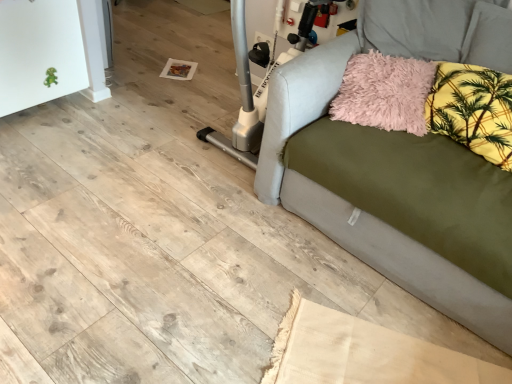
What do you see at coordinates (396, 163) in the screenshot? The image size is (512, 384). I see `olive green fabric couch at right` at bounding box center [396, 163].

What are the coordinates of `yellow floral fabric pillow at upper right, acting as the 1th pillow starting from the right` in the screenshot? It's located at point(473,110).

Locate an element on the screen. Image resolution: width=512 pixels, height=384 pixels. beige fabric rug at lower center is located at coordinates (362, 353).

Locate an element on the screen. The width and height of the screenshot is (512, 384). fluffy pink pillow at upper right, placed as the second pillow when sorted from right to left is located at coordinates (384, 92).

Locate an element on the screen. olive green fabric couch at right is located at coordinates (396, 163).

Is fluffy pink pillow at upper right, which ranks as the first pillow in left-to-right order, in front of or behind yellow floral fabric pillow at upper right, acting as the 1th pillow starting from the right, in the image?

Clearly, fluffy pink pillow at upper right, which ranks as the first pillow in left-to-right order, is behind yellow floral fabric pillow at upper right, acting as the 1th pillow starting from the right.

Looking at this image, considering the relative sizes of fluffy pink pillow at upper right, which ranks as the first pillow in left-to-right order, and yellow floral fabric pillow at upper right, acting as the 1th pillow starting from the right, in the image provided, is fluffy pink pillow at upper right, which ranks as the first pillow in left-to-right order, bigger than yellow floral fabric pillow at upper right, acting as the 1th pillow starting from the right,?

No, fluffy pink pillow at upper right, which ranks as the first pillow in left-to-right order, is not bigger than yellow floral fabric pillow at upper right, acting as the 1th pillow starting from the right.

Considering the points (423, 68) and (457, 77), which point is in front, point (423, 68) or point (457, 77)?

Point (457, 77)

Are fluffy pink pillow at upper right, which ranks as the first pillow in left-to-right order, and yellow floral fabric pillow at upper right, acting as the 1th pillow starting from the right, beside each other?

No, fluffy pink pillow at upper right, which ranks as the first pillow in left-to-right order, is not next to yellow floral fabric pillow at upper right, acting as the 1th pillow starting from the right.

Are beige fabric rug at lower center and fluffy pink pillow at upper right, placed as the second pillow when sorted from right to left, beside each other?

No, beige fabric rug at lower center is not making contact with fluffy pink pillow at upper right, placed as the second pillow when sorted from right to left.

Who is shorter, beige fabric rug at lower center or fluffy pink pillow at upper right, placed as the second pillow when sorted from right to left?

beige fabric rug at lower center is shorter.

Is beige fabric rug at lower center at the left side of fluffy pink pillow at upper right, placed as the second pillow when sorted from right to left?

Yes.

From a real-world perspective, is beige fabric rug at lower center below fluffy pink pillow at upper right, placed as the second pillow when sorted from right to left?

Yes, from a real-world perspective, beige fabric rug at lower center is below fluffy pink pillow at upper right, placed as the second pillow when sorted from right to left.

Is beige fabric rug at lower center facing away from yellow floral fabric pillow at upper right, acting as the 1th pillow starting from the right?

No, yellow floral fabric pillow at upper right, acting as the 1th pillow starting from the right, is not at the back of beige fabric rug at lower center.

What's the angular difference between beige fabric rug at lower center and yellow floral fabric pillow at upper right, acting as the 1th pillow starting from the right,'s facing directions?

There is a 81.9-degree angle between the facing directions of beige fabric rug at lower center and yellow floral fabric pillow at upper right, acting as the 1th pillow starting from the right.

Can you confirm if beige fabric rug at lower center is shorter than yellow floral fabric pillow at upper right, acting as the 1th pillow starting from the right?

Indeed, beige fabric rug at lower center has a lesser height compared to yellow floral fabric pillow at upper right, acting as the 1th pillow starting from the right.

The width and height of the screenshot is (512, 384). What are the coordinates of `pillow that is the 2nd one when counting rightward from the beige fabric rug at lower center` in the screenshot? It's located at (473, 110).

At what (x,y) coordinates should I click in order to perform the action: click on pillow that is on the right side of olive green fabric couch at right. Please return your answer as a coordinate pair (x, y). This screenshot has height=384, width=512. Looking at the image, I should click on (473, 110).

Is yellow floral fabric pillow at upper right, the 2th pillow from the left, located within olive green fabric couch at right?

Yes, yellow floral fabric pillow at upper right, the 2th pillow from the left, is inside olive green fabric couch at right.

From the image's perspective, who appears lower, olive green fabric couch at right or yellow floral fabric pillow at upper right, the 2th pillow from the left?

olive green fabric couch at right, from the image's perspective.

From the image's perspective, is yellow floral fabric pillow at upper right, acting as the 1th pillow starting from the right, above or below olive green fabric couch at right?

yellow floral fabric pillow at upper right, acting as the 1th pillow starting from the right, is above olive green fabric couch at right.

Is yellow floral fabric pillow at upper right, the 2th pillow from the left, positioned with its back to olive green fabric couch at right?

Yes, olive green fabric couch at right is at the back of yellow floral fabric pillow at upper right, the 2th pillow from the left.

Where is `pillow that appears on the right of olive green fabric couch at right`? pillow that appears on the right of olive green fabric couch at right is located at coordinates (473, 110).

Could you measure the distance between yellow floral fabric pillow at upper right, the 2th pillow from the left, and olive green fabric couch at right?

10.53 inches.

From a real-world perspective, is olive green fabric couch at right positioned above or below beige fabric rug at lower center?

From a real-world perspective, olive green fabric couch at right is physically above beige fabric rug at lower center.

From the picture: Is olive green fabric couch at right far from beige fabric rug at lower center?

No, olive green fabric couch at right is not far away from beige fabric rug at lower center.

Locate an element on the screen. Image resolution: width=512 pixels, height=384 pixels. studio couch located above the beige fabric rug at lower center (from a real-world perspective) is located at coordinates (396, 163).

Considering the relative sizes of olive green fabric couch at right and beige fabric rug at lower center in the image provided, is olive green fabric couch at right wider than beige fabric rug at lower center?

Correct, the width of olive green fabric couch at right exceeds that of beige fabric rug at lower center.

Is beige fabric rug at lower center surrounded by fluffy pink pillow at upper right, which ranks as the first pillow in left-to-right order?

Actually, beige fabric rug at lower center is outside fluffy pink pillow at upper right, which ranks as the first pillow in left-to-right order.

Can you confirm if fluffy pink pillow at upper right, which ranks as the first pillow in left-to-right order, is bigger than beige fabric rug at lower center?

Indeed, fluffy pink pillow at upper right, which ranks as the first pillow in left-to-right order, has a larger size compared to beige fabric rug at lower center.

What's the angular difference between fluffy pink pillow at upper right, placed as the second pillow when sorted from right to left, and beige fabric rug at lower center's facing directions?

There is a 95.8-degree angle between the facing directions of fluffy pink pillow at upper right, placed as the second pillow when sorted from right to left, and beige fabric rug at lower center.

Considering the positions of objects fluffy pink pillow at upper right, placed as the second pillow when sorted from right to left, and beige fabric rug at lower center in the image provided, who is in front, fluffy pink pillow at upper right, placed as the second pillow when sorted from right to left, or beige fabric rug at lower center?

beige fabric rug at lower center is more forward.

The height and width of the screenshot is (384, 512). In order to click on pillow behind the yellow floral fabric pillow at upper right, the 2th pillow from the left in this screenshot , I will do `click(384, 92)`.

The width and height of the screenshot is (512, 384). Identify the location of cardboard in front of the fluffy pink pillow at upper right, placed as the second pillow when sorted from right to left. pos(362,353).

When comparing their distances from yellow floral fabric pillow at upper right, acting as the 1th pillow starting from the right, does olive green fabric couch at right or beige fabric rug at lower center seem closer?

olive green fabric couch at right lies closer to yellow floral fabric pillow at upper right, acting as the 1th pillow starting from the right, than the other object.

When comparing their distances from fluffy pink pillow at upper right, placed as the second pillow when sorted from right to left, does yellow floral fabric pillow at upper right, acting as the 1th pillow starting from the right, or beige fabric rug at lower center seem further?

beige fabric rug at lower center is positioned further to the anchor fluffy pink pillow at upper right, placed as the second pillow when sorted from right to left.

Which object lies nearer to the anchor point olive green fabric couch at right, beige fabric rug at lower center or yellow floral fabric pillow at upper right, acting as the 1th pillow starting from the right?

The object closer to olive green fabric couch at right is yellow floral fabric pillow at upper right, acting as the 1th pillow starting from the right.

Based on their spatial positions, is fluffy pink pillow at upper right, placed as the second pillow when sorted from right to left, or beige fabric rug at lower center closer to yellow floral fabric pillow at upper right, the 2th pillow from the left?

fluffy pink pillow at upper right, placed as the second pillow when sorted from right to left.

When comparing their distances from beige fabric rug at lower center, does yellow floral fabric pillow at upper right, the 2th pillow from the left, or olive green fabric couch at right seem further?

yellow floral fabric pillow at upper right, the 2th pillow from the left.

Looking at this image, which object lies further to the anchor point olive green fabric couch at right, yellow floral fabric pillow at upper right, acting as the 1th pillow starting from the right, or fluffy pink pillow at upper right, which ranks as the first pillow in left-to-right order?

yellow floral fabric pillow at upper right, acting as the 1th pillow starting from the right, is positioned further to the anchor olive green fabric couch at right.

Based on their spatial positions, is fluffy pink pillow at upper right, placed as the second pillow when sorted from right to left, or olive green fabric couch at right further from yellow floral fabric pillow at upper right, the 2th pillow from the left?

olive green fabric couch at right is positioned further to the anchor yellow floral fabric pillow at upper right, the 2th pillow from the left.

Considering their positions, is yellow floral fabric pillow at upper right, the 2th pillow from the left, positioned further to fluffy pink pillow at upper right, placed as the second pillow when sorted from right to left, than olive green fabric couch at right?

Among the two, olive green fabric couch at right is located further to fluffy pink pillow at upper right, placed as the second pillow when sorted from right to left.

Where is `pillow located between olive green fabric couch at right and fluffy pink pillow at upper right, which ranks as the first pillow in left-to-right order, in the depth direction`? This screenshot has height=384, width=512. pillow located between olive green fabric couch at right and fluffy pink pillow at upper right, which ranks as the first pillow in left-to-right order, in the depth direction is located at coordinates (473, 110).

You are a GUI agent. You are given a task and a screenshot of the screen. Output one action in this format:
    pyautogui.click(x=<x>, y=<y>)
    Task: Click on the studio couch between fluffy pink pillow at upper right, which ranks as the first pillow in left-to-right order, and beige fabric rug at lower center in the up-down direction
    The height and width of the screenshot is (384, 512).
    Given the screenshot: What is the action you would take?
    pyautogui.click(x=396, y=163)

In order to click on pillow that lies between fluffy pink pillow at upper right, placed as the second pillow when sorted from right to left, and beige fabric rug at lower center from top to bottom in this screenshot , I will do `click(473, 110)`.

You are a GUI agent. You are given a task and a screenshot of the screen. Output one action in this format:
    pyautogui.click(x=<x>, y=<y>)
    Task: Click on the studio couch between yellow floral fabric pillow at upper right, the 2th pillow from the left, and beige fabric rug at lower center in the up-down direction
    
    Given the screenshot: What is the action you would take?
    pyautogui.click(x=396, y=163)